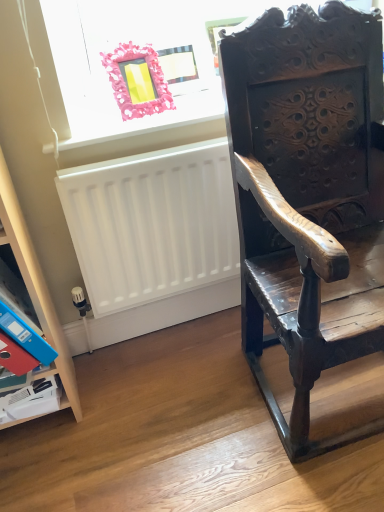
What are the coordinates of `vacant space in between dark wood carved chair at right and white matte radiator at lower left` in the screenshot? It's located at click(203, 390).